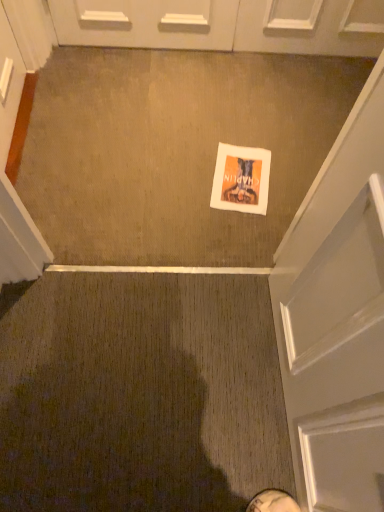
Question: From a real-world perspective, is white paper flyer at center below white leather shoe at lower center?

Choices:
 (A) yes
 (B) no

Answer: (A)

Question: Does white paper flyer at center appear on the left side of white leather shoe at lower center?

Choices:
 (A) no
 (B) yes

Answer: (B)

Question: Is white paper flyer at center smaller than white leather shoe at lower center?

Choices:
 (A) no
 (B) yes

Answer: (B)

Question: Considering the relative positions of white paper flyer at center and white leather shoe at lower center in the image provided, is white paper flyer at center to the right of white leather shoe at lower center from the viewer's perspective?

Choices:
 (A) no
 (B) yes

Answer: (A)

Question: Is white paper flyer at center aimed at white leather shoe at lower center?

Choices:
 (A) no
 (B) yes

Answer: (A)

Question: Is white paper flyer at center taller than white leather shoe at lower center?

Choices:
 (A) yes
 (B) no

Answer: (B)

Question: Is the depth of white leather shoe at lower center greater than that of white paper flyer at center?

Choices:
 (A) yes
 (B) no

Answer: (B)

Question: Is white leather shoe at lower center next to white paper flyer at center and touching it?

Choices:
 (A) yes
 (B) no

Answer: (B)

Question: Considering the relative sizes of white leather shoe at lower center and white paper flyer at center in the image provided, is white leather shoe at lower center wider than white paper flyer at center?

Choices:
 (A) yes
 (B) no

Answer: (B)

Question: Would you say white leather shoe at lower center is outside white paper flyer at center?

Choices:
 (A) no
 (B) yes

Answer: (B)

Question: Is white leather shoe at lower center taller than white paper flyer at center?

Choices:
 (A) no
 (B) yes

Answer: (B)

Question: Does white leather shoe at lower center have a lesser width compared to white paper flyer at center?

Choices:
 (A) no
 (B) yes

Answer: (B)

Question: From a real-world perspective, is white paper flyer at center physically above white glossy door at upper center?

Choices:
 (A) no
 (B) yes

Answer: (A)